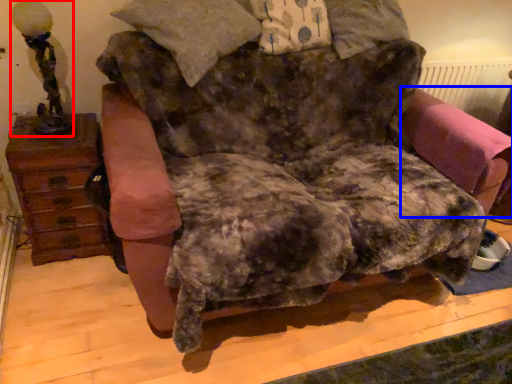
Question: Which object appears farthest to the camera in this image, table lamp (highlighted by a red box) or swivel chair (highlighted by a blue box)?

Choices:
 (A) table lamp
 (B) swivel chair

Answer: (B)